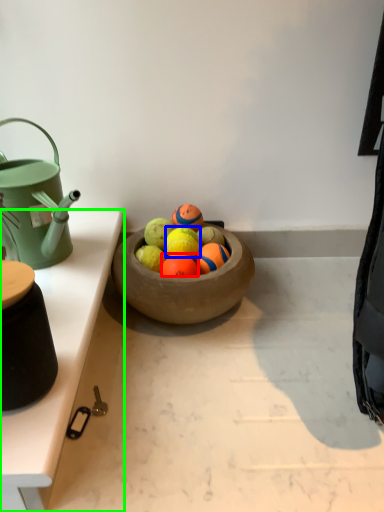
Question: Which object is positioned farthest from fruit (highlighted by a red box)? Select from fruit (highlighted by a blue box) and table (highlighted by a green box).

Choices:
 (A) fruit
 (B) table

Answer: (B)